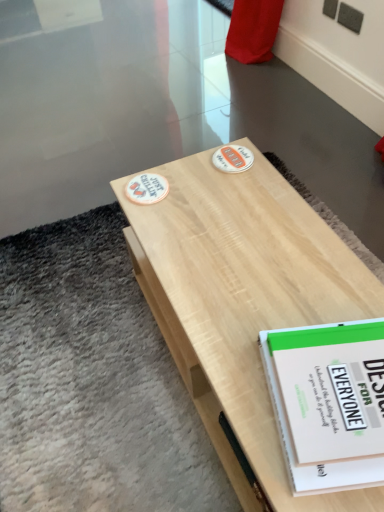
Question: From a real-world perspective, is light wood table at center physically located above or below white paper book at center?

Choices:
 (A) below
 (B) above

Answer: (A)

Question: Is light wood table at center wider or thinner than white paper book at center?

Choices:
 (A) wide
 (B) thin

Answer: (A)

Question: From the image's perspective, is light wood table at center positioned above or below white paper book at center?

Choices:
 (A) below
 (B) above

Answer: (B)

Question: Is point (306, 436) closer or farther from the camera than point (195, 303)?

Choices:
 (A) closer
 (B) farther

Answer: (A)

Question: Considering their positions, is white paper book at center located in front of or behind light wood table at center?

Choices:
 (A) front
 (B) behind

Answer: (B)

Question: Considering the positions of white paper book at center and light wood table at center in the image, is white paper book at center wider or thinner than light wood table at center?

Choices:
 (A) thin
 (B) wide

Answer: (A)

Question: In the image, is white paper book at center on the left side or the right side of light wood table at center?

Choices:
 (A) left
 (B) right

Answer: (B)